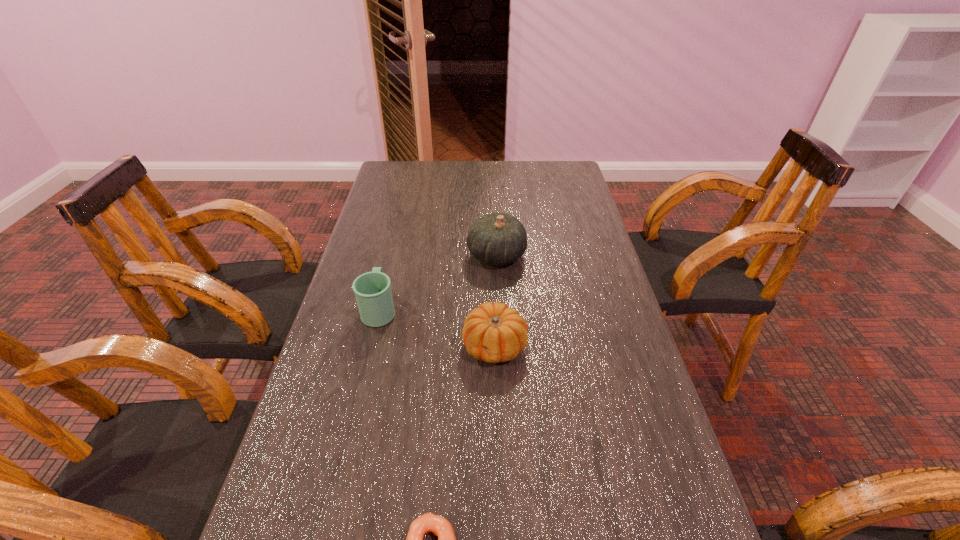
Locate an element on the screen. object located at the left edge is located at coordinates click(x=373, y=293).

I want to click on blank space at the far edge of the desktop, so click(x=470, y=179).

In the image, there is a desktop. Identify the location of vacant space at the left edge. (408, 211).

Find the location of a particular element. vacant space at the right edge of the desktop is located at coordinates (576, 290).

The width and height of the screenshot is (960, 540). Find the location of `vacant space at the far left corner`. vacant space at the far left corner is located at coordinates tap(416, 166).

In the image, there is a desktop. At what (x,y) coordinates should I click in order to perform the action: click on vacant space at the far right corner. Please return your answer as a coordinate pair (x, y). The image size is (960, 540). Looking at the image, I should click on click(565, 163).

This screenshot has height=540, width=960. I want to click on vacant space that's between the nearer gourd and the mug, so click(437, 328).

Find the location of a particular element. The height and width of the screenshot is (540, 960). object that ranks as the third closest to the leftmost object is located at coordinates (441, 527).

Identify the location of object that stands as the third closest to the farther gourd. (441, 527).

Locate an element on the screen. The width and height of the screenshot is (960, 540). free spot that satisfies the following two spatial constraints: 1. on the side of the leftmost object with the handle; 2. on the right side of the farthest object is located at coordinates (393, 255).